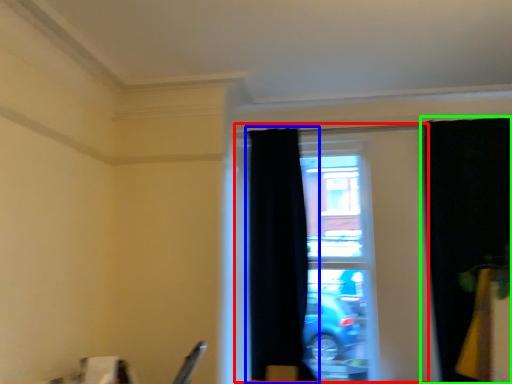
Question: Estimate the real-world distances between objects in this image. Which object is farther from window (highlighted by a red box), curtain (highlighted by a blue box) or curtain (highlighted by a green box)?

Choices:
 (A) curtain
 (B) curtain

Answer: (A)